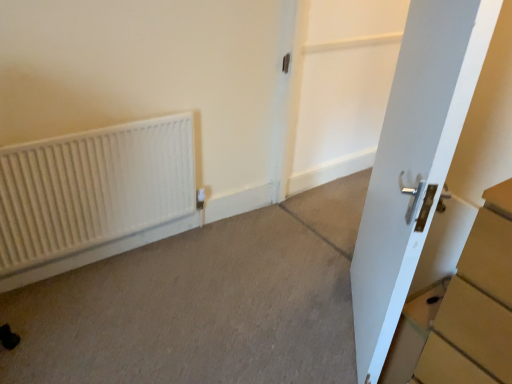
Question: Is gray carpet at lower left outside of white glossy door at right?

Choices:
 (A) no
 (B) yes

Answer: (B)

Question: Can you confirm if gray carpet at lower left is positioned to the right of white glossy door at right?

Choices:
 (A) no
 (B) yes

Answer: (A)

Question: From a real-world perspective, is gray carpet at lower left below white glossy door at right?

Choices:
 (A) yes
 (B) no

Answer: (A)

Question: Does gray carpet at lower left have a lesser width compared to white glossy door at right?

Choices:
 (A) yes
 (B) no

Answer: (B)

Question: Considering the relative sizes of gray carpet at lower left and white glossy door at right in the image provided, is gray carpet at lower left smaller than white glossy door at right?

Choices:
 (A) no
 (B) yes

Answer: (B)

Question: Are gray carpet at lower left and white glossy door at right far apart?

Choices:
 (A) yes
 (B) no

Answer: (B)

Question: Would you say gray carpet at lower left is part of white glossy door at center's contents?

Choices:
 (A) yes
 (B) no

Answer: (B)

Question: Would you say white glossy door at center is a long distance from gray carpet at lower left?

Choices:
 (A) no
 (B) yes

Answer: (B)

Question: Does white glossy door at center have a greater height compared to gray carpet at lower left?

Choices:
 (A) yes
 (B) no

Answer: (A)

Question: Is white glossy door at center looking in the opposite direction of gray carpet at lower left?

Choices:
 (A) no
 (B) yes

Answer: (A)

Question: Does white glossy door at center have a larger size compared to gray carpet at lower left?

Choices:
 (A) no
 (B) yes

Answer: (B)

Question: Can you confirm if white glossy door at center is thinner than gray carpet at lower left?

Choices:
 (A) no
 (B) yes

Answer: (B)

Question: Can you confirm if gray carpet at lower left is smaller than white matte radiator at left?

Choices:
 (A) no
 (B) yes

Answer: (B)